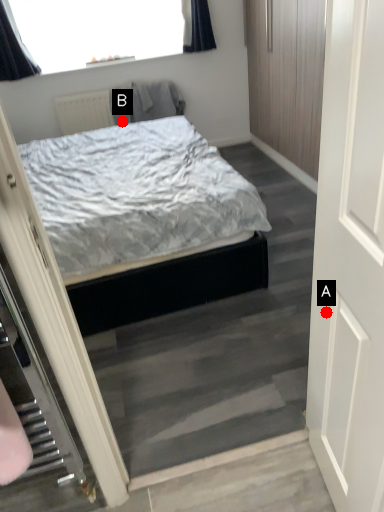
Question: Two points are circled on the image, labeled by A and B beside each circle. Which point is further to the camera?

Choices:
 (A) A is further
 (B) B is further

Answer: (B)